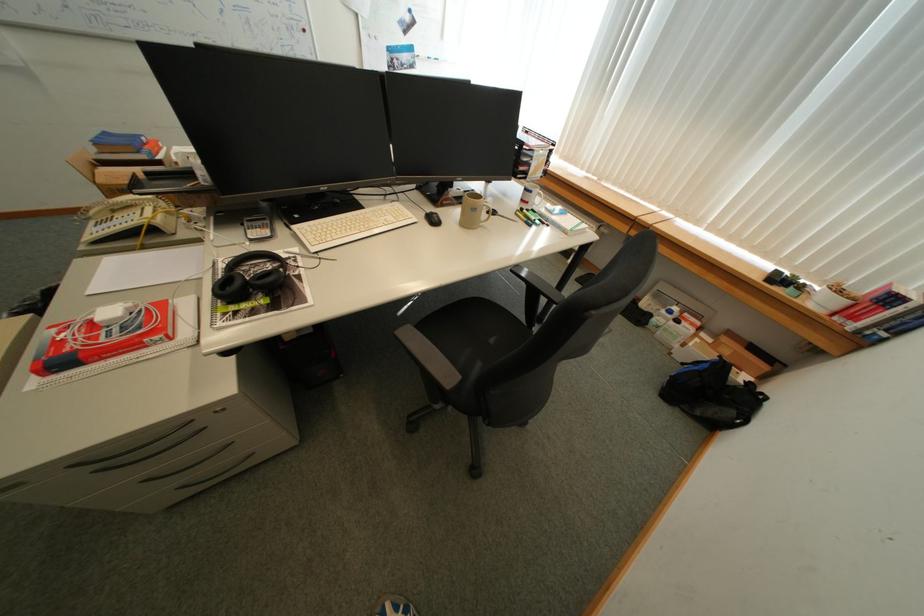
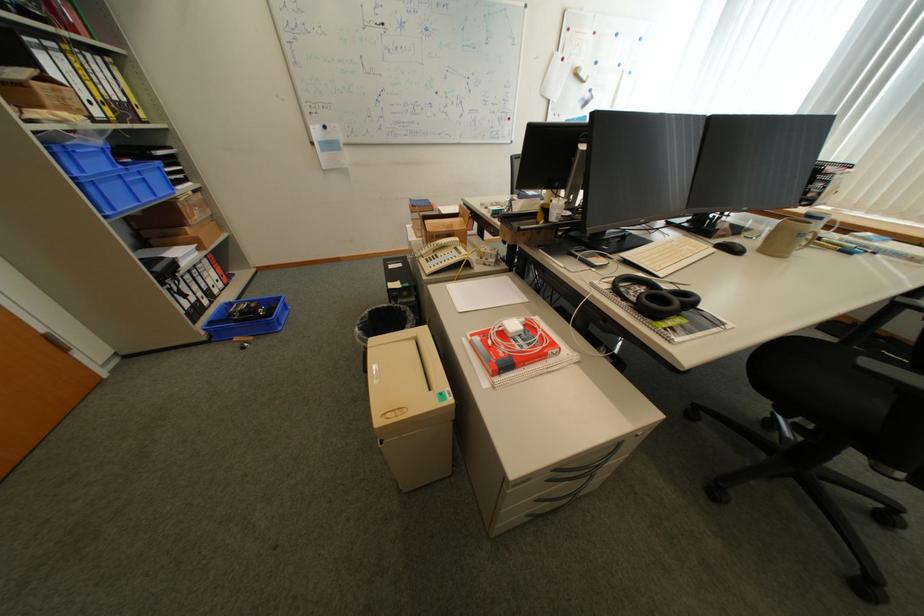
Question: What movement of the cameraman would produce the second image?

Choices:
 (A) Left
 (B) Right
 (C) Forward
 (D) Backward

Answer: (A)